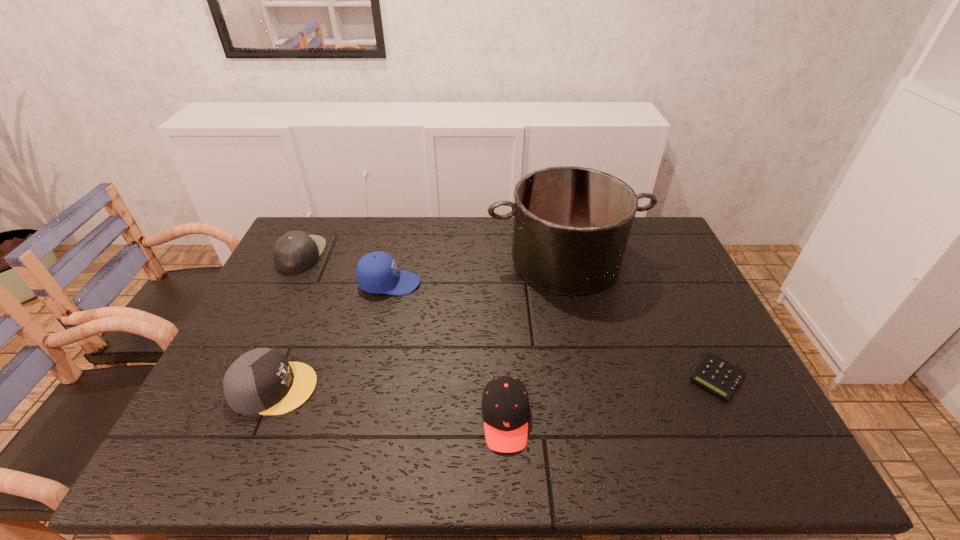
Image resolution: width=960 pixels, height=540 pixels. Find the location of `pan`. pan is located at coordinates (571, 227).

The height and width of the screenshot is (540, 960). What are the coordinates of `the third object from left to right` in the screenshot? It's located at (377, 272).

The height and width of the screenshot is (540, 960). I want to click on the shortest cap, so [x=505, y=406].

What are the coordinates of `the second shortest object` in the screenshot? It's located at (505, 406).

Image resolution: width=960 pixels, height=540 pixels. Find the location of `the shortest object`. the shortest object is located at coordinates (715, 374).

Where is `vacant region located on the front of the pan`? This screenshot has width=960, height=540. vacant region located on the front of the pan is located at coordinates (577, 314).

Locate an element on the screen. The width and height of the screenshot is (960, 540). vacant region located on the front-facing side of the fourth object from right to left is located at coordinates (522, 284).

Find the location of a particular element. The height and width of the screenshot is (540, 960). vacant space located on the left of the shortest object is located at coordinates (548, 377).

Identify the location of pan that is at the far edge. This screenshot has height=540, width=960. (571, 227).

Locate an element on the screen. cap at the far edge is located at coordinates (296, 251).